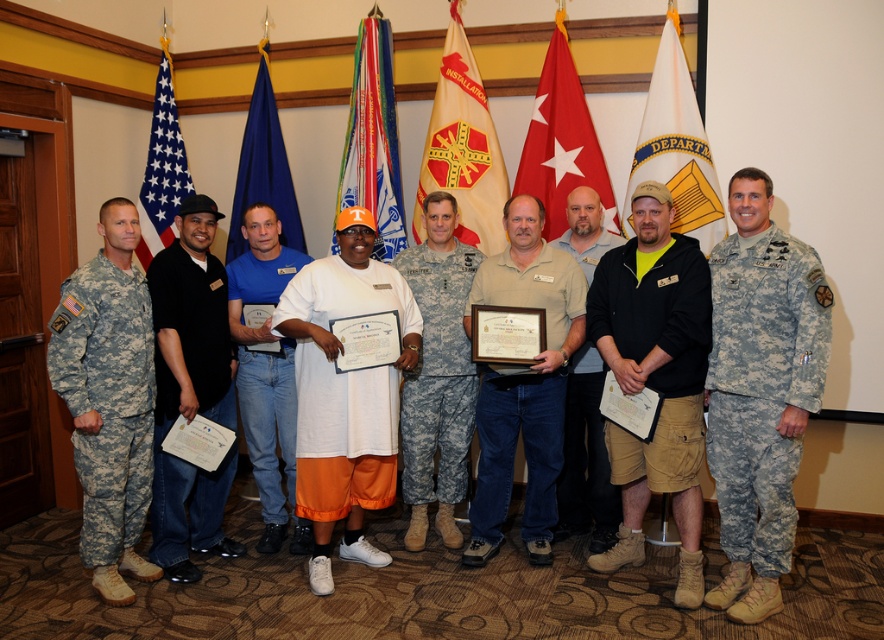
You are standing in the room and want to move from the point at coordinates point (576,196) to the point at coordinates point (574,74). Which direction should you move to get closer to the backdrop with the flags?

You should move towards the point at coordinates point (574,74) because it is farther from the viewer and closer to the backdrop with the flags than the point at coordinates point (576,196).

You are standing in the room and want to find the blue denim jeans at center. According to the coordinates provided, where should you look?

You should look at point 0.567 on the x axis and 0.300 on the y axis to find the blue denim jeans at center.